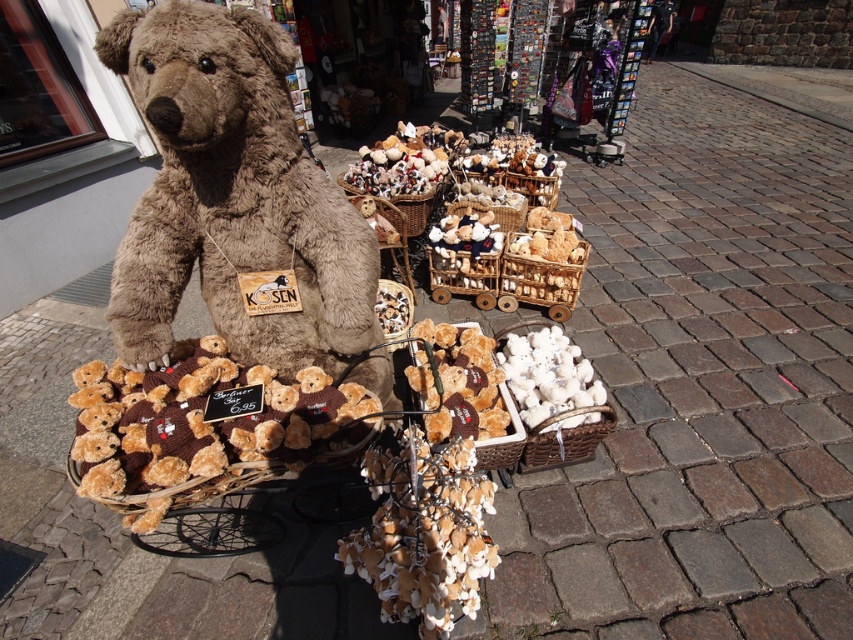
You are a customer at the market and want to know the distance between the white fabric basket at center and the knitted brown teddy bear basket at center. Can you tell me how far apart they are?

The white fabric basket at center is 4.89 feet from the knitted brown teddy bear basket at center.